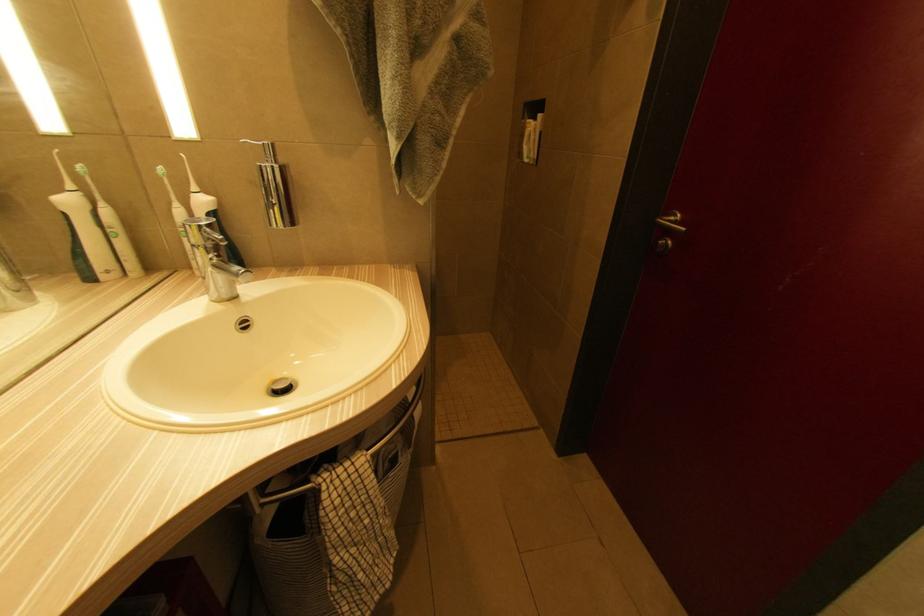
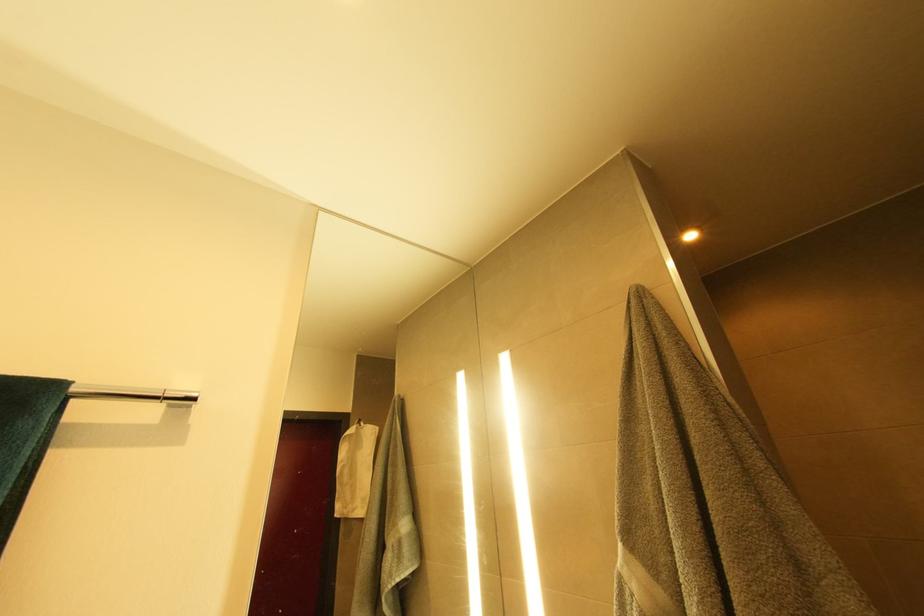
Based on the photo, the images are taken continuously from a first-person perspective. In which direction is your viewpoint rotating?

The camera's rotation is toward left-up.